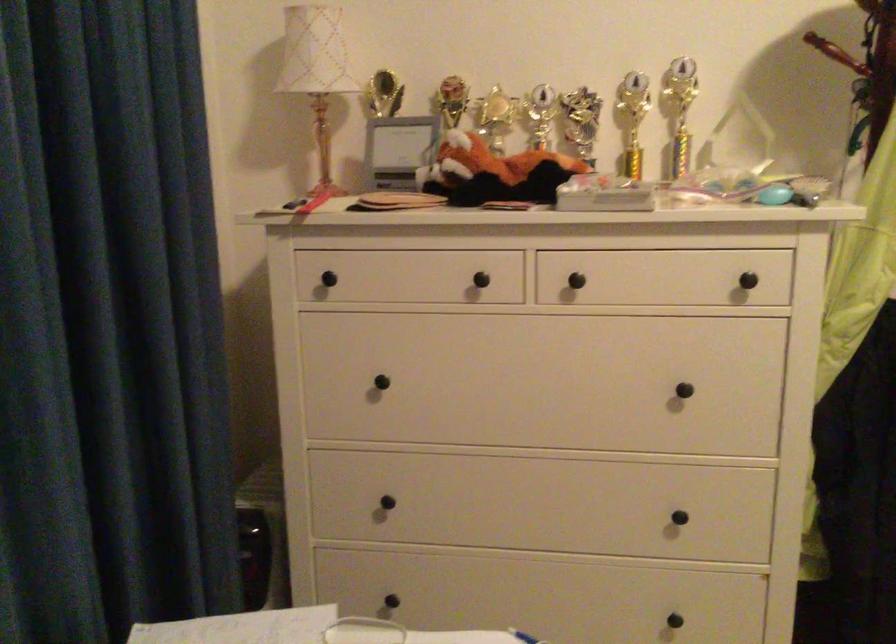
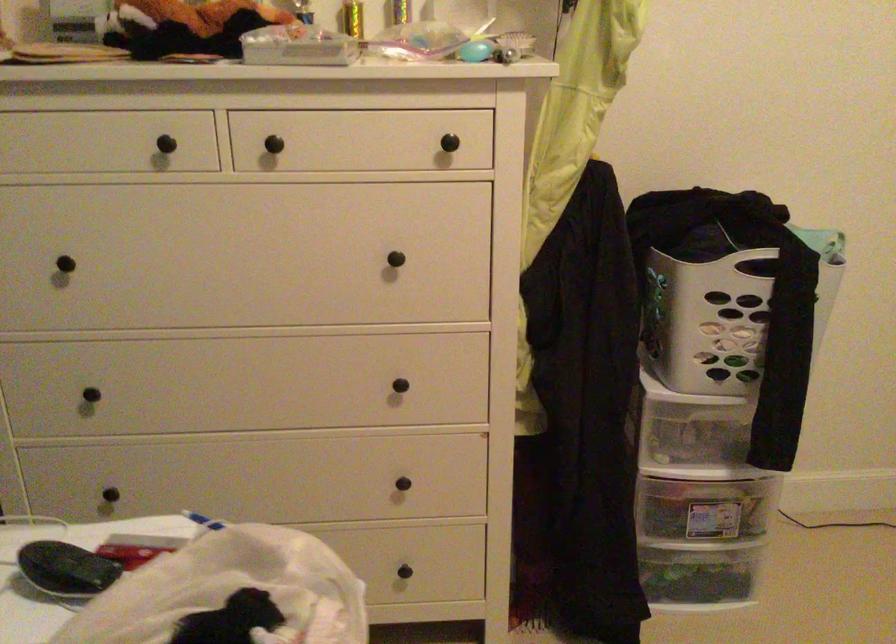
Locate, in the second image, the point that corresponds to (x=754, y=268) in the first image.

(453, 128)